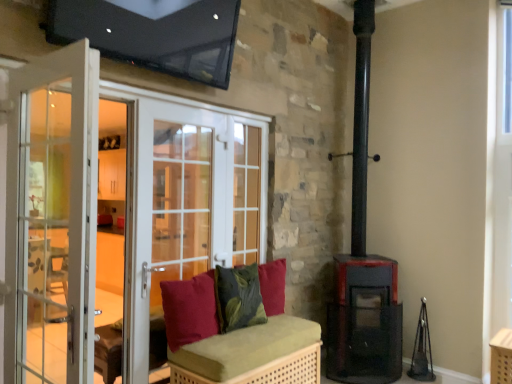
What are the coordinates of `vacant space to the right of green textured cushion at center, which ranks as the second pillow in back-to-front order` in the screenshot? It's located at (280, 326).